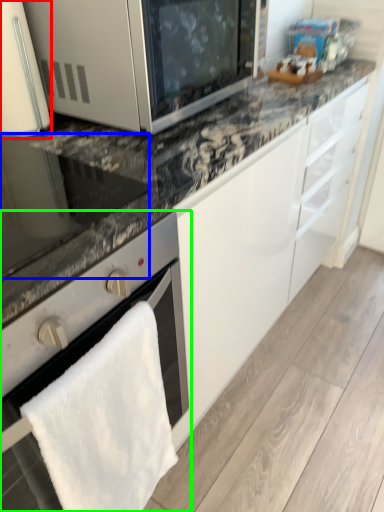
Question: Estimate the real-world distances between objects in this image. Which object is closer to home appliance (highlighted by a red box), appliance (highlighted by a blue box) or oven (highlighted by a green box)?

Choices:
 (A) appliance
 (B) oven

Answer: (A)